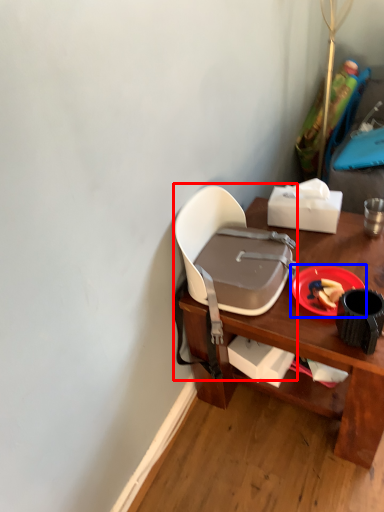
Question: Which object is further to the camera taking this photo, chair (highlighted by a red box) or plate (highlighted by a blue box)?

Choices:
 (A) chair
 (B) plate

Answer: (B)